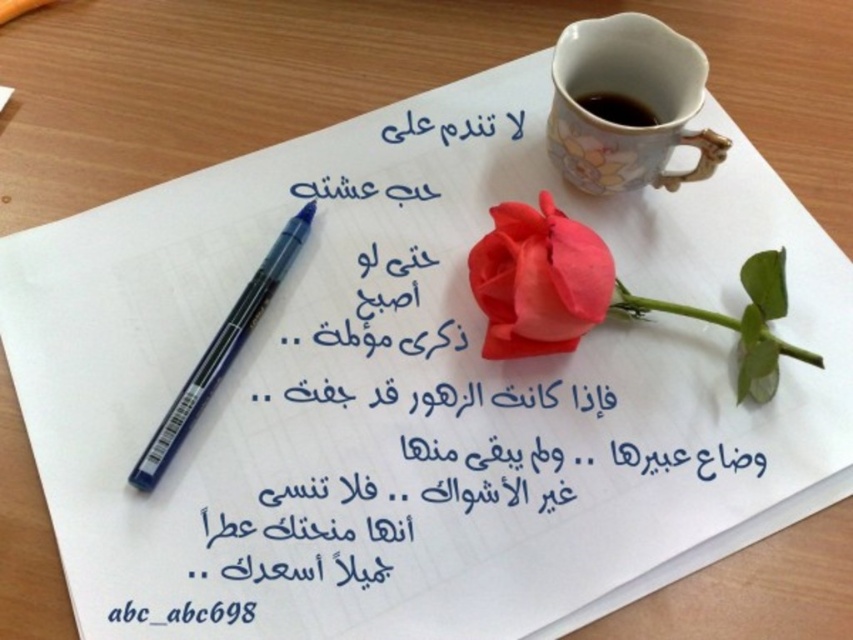
From the picture: Is glossy ceramic cup at upper center to the left of blue plastic pen at upper left from the viewer's perspective?

Incorrect, glossy ceramic cup at upper center is not on the left side of blue plastic pen at upper left.

In the scene shown: Who is more forward, (665, 90) or (231, 340)?

Point (231, 340) is in front.

Does point (616, 52) come closer to viewer compared to point (190, 404)?

No, it is not.

I want to click on glossy ceramic cup at upper center, so click(630, 99).

Is matte pink rose at center taller than glossy ceramic mug at upper center?

Yes.

Is matte pink rose at center wider than glossy ceramic mug at upper center?

Yes, matte pink rose at center is wider than glossy ceramic mug at upper center.

Where is `matte pink rose at center`? The width and height of the screenshot is (853, 640). matte pink rose at center is located at coordinates (538, 280).

Find the location of `matte pink rose at center`. matte pink rose at center is located at coordinates (538, 280).

Which is above, matte pink rose at center or blue plastic pen at upper left?

matte pink rose at center

Consider the image. Is matte pink rose at center taller than blue plastic pen at upper left?

No.

Locate an element on the screen. The image size is (853, 640). matte pink rose at center is located at coordinates (538, 280).